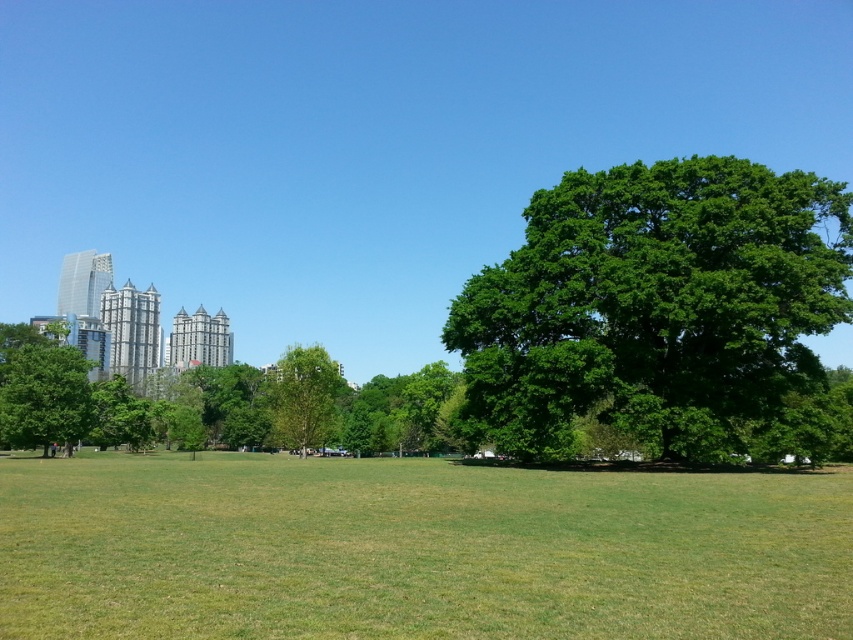
In the scene shown: You are planning to plant a new tree in the park. You have two options based on the image. The green leafy tree at right and the green leafy tree at left are both present. Which tree would require more space due to its size?

The green leafy tree at right has a larger size compared to the green leafy tree at left, so it would require more space.

You are standing in the park and want to find the tallest tree to rest under. Which tree should you choose between the green leafy tree at right and the green leafy tree at center?

The green leafy tree at right is much taller than the green leafy tree at center, so you should choose the green leafy tree at right to rest under.